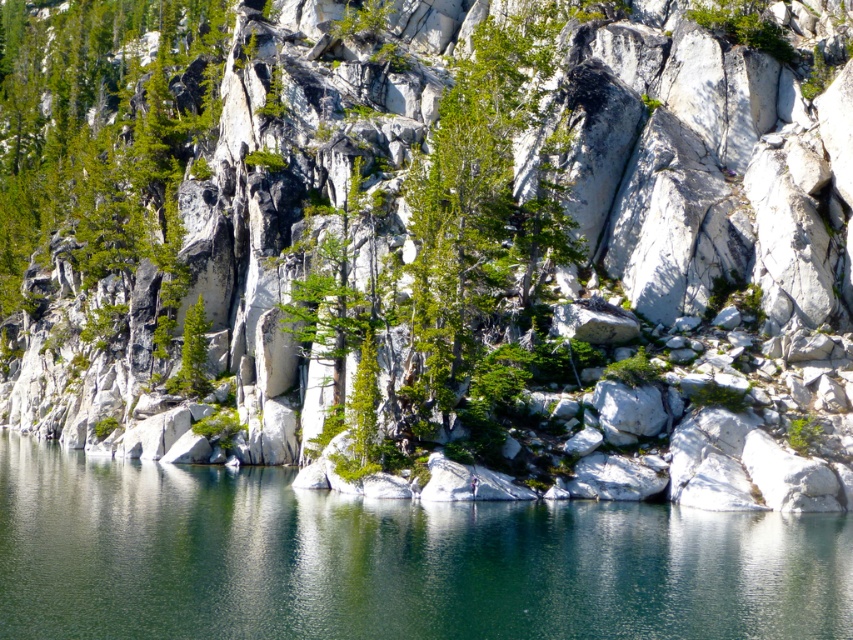
Which of these two, green marble water at center or green leafy tree at center, stands taller?

green leafy tree at center

Identify the location of green marble water at center. coord(389,561).